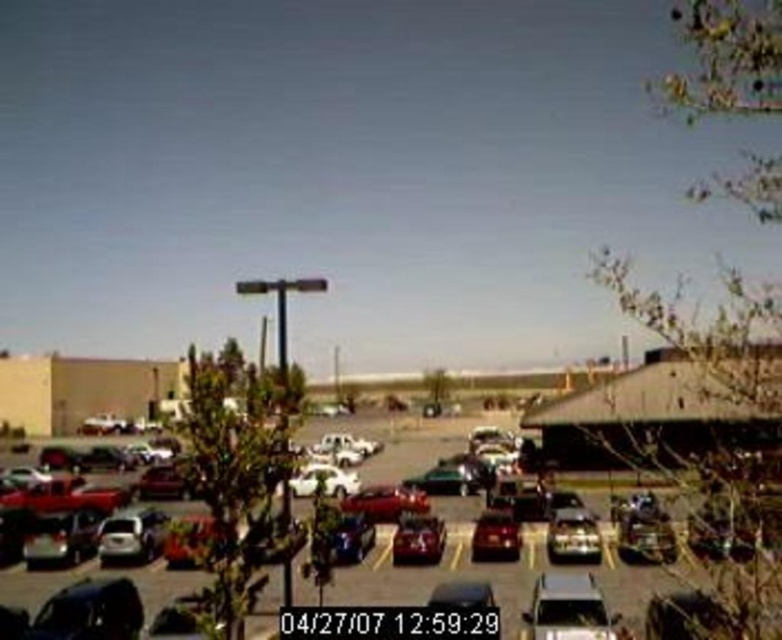
Question: Which object is the farthest from the satin silver sedan at center?

Choices:
 (A) shiny silver sedan at center
 (B) matte black car at center
 (C) metallic silver car at center

Answer: (C)

Question: Is the position of metallic silver car at center less distant than that of silver metallic sedan at center?

Choices:
 (A) yes
 (B) no

Answer: (A)

Question: Is silver metallic sedan at center positioned behind white matte car at center?

Choices:
 (A) no
 (B) yes

Answer: (B)

Question: Can you confirm if glossy metallic car at center is bigger than matte black car at center?

Choices:
 (A) no
 (B) yes

Answer: (A)

Question: Which object is the closest to the satin silver sedan at center?

Choices:
 (A) shiny red car at center
 (B) shiny red sedan at center

Answer: (A)

Question: Which point is farther to the camera?

Choices:
 (A) shiny red sedan at center
 (B) satin silver sedan at center

Answer: (A)